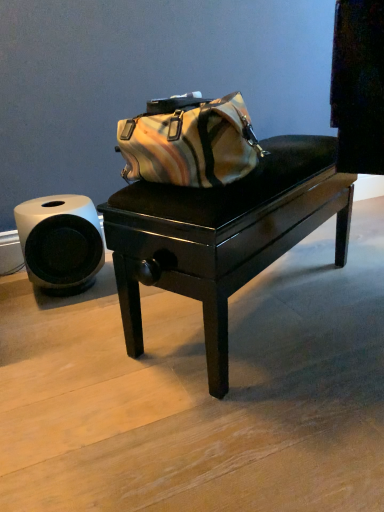
Find the location of a particular element. Image resolution: width=384 pixels, height=512 pixels. vacant space to the right of glossy black table at center is located at coordinates (352, 289).